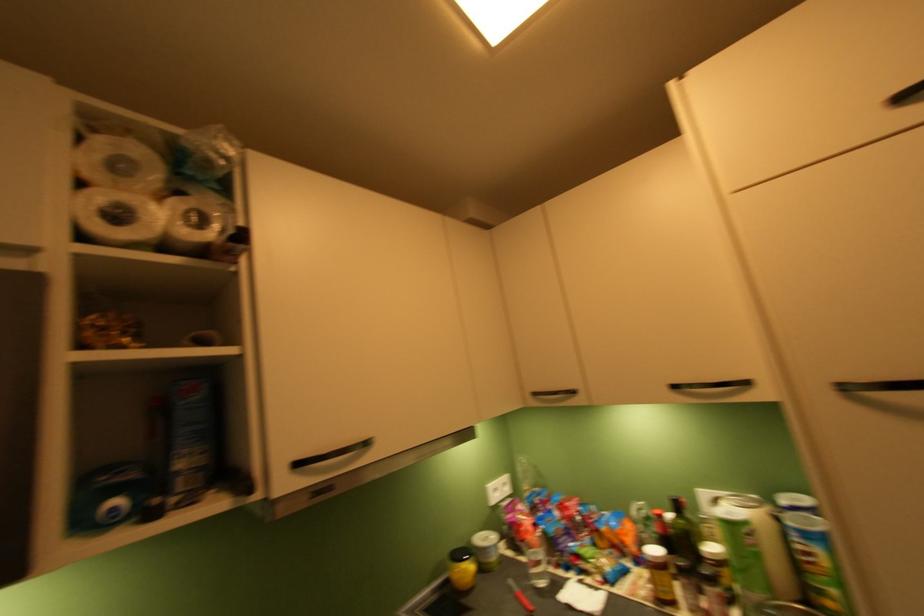
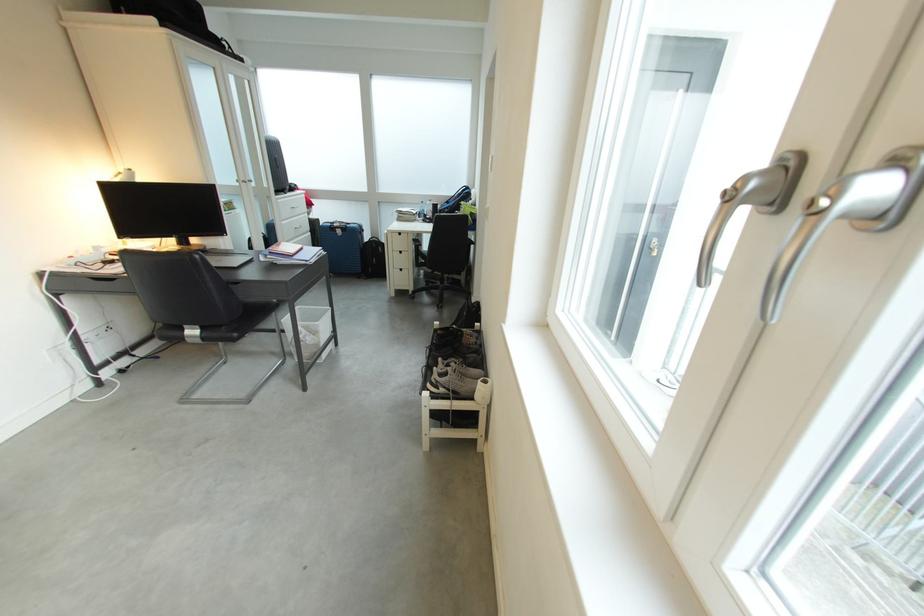
Question: I am providing you with two images of the same scene from different viewpoints. Which of the following objects are not visible in image2?

Choices:
 (A) white waste bin
 (B) gray tool case
 (C) blue cylindrical can
 (D) black chair sitting surface

Answer: (C)